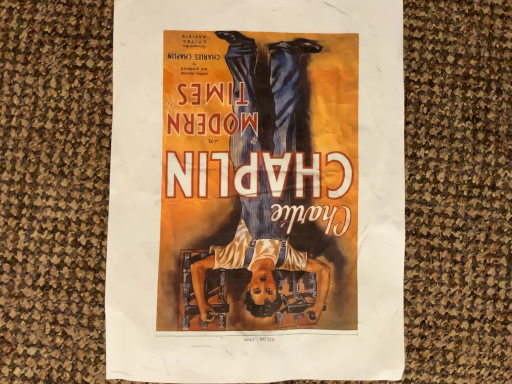
Question: Should I look upward or downward to see matte paper poster at center?

Choices:
 (A) up
 (B) down

Answer: (A)